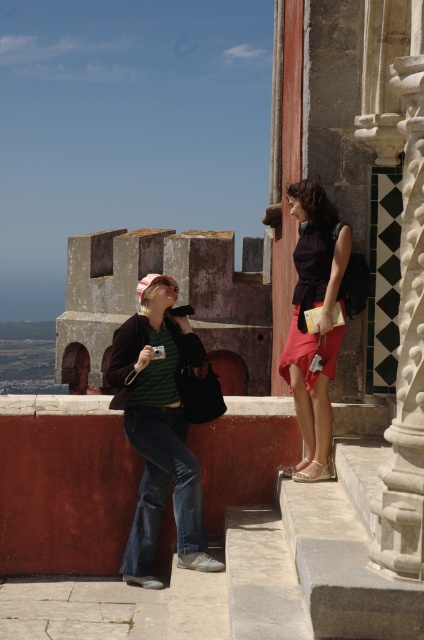
Based on the coordinates provided, which object is located at point (159, 428)?

The point (159, 428) is on the green striped shirt at center.

You are a photographer trying to capture a candid shot of both individuals. Since you want to ensure both subjects are fully visible in the frame, which direction should you position yourself relative to the green striped shirt at center and matte black top at center?

To capture both subjects fully in the frame, position yourself to the right of the green striped shirt at center and matte black top at center. Since the green striped shirt at center is to the left of the matte black top at center, positioning yourself to the right would allow both to be visible without any overlap.

From the picture: You are standing on the staircase and want to hand a brochure to both people. Since you can only reach those closer to you, can you reach the person wearing the green striped shirt at center and the matte black top at center?

The green striped shirt at center is closer to the viewer than the matte black top at center, so you can reach the person with the green striped shirt at center but not the matte black top at center.